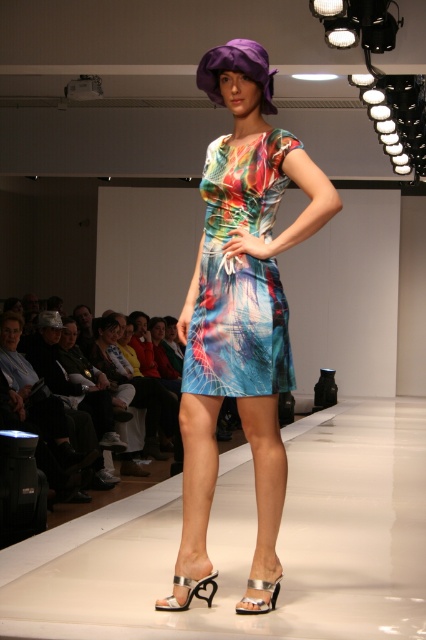
Between point (196, 285) and point (230, 202), which one is positioned behind?

Point (196, 285)

Is printed fabric dress at center shorter than multicolored printed fabric dress at center?

Incorrect, printed fabric dress at center's height does not fall short of multicolored printed fabric dress at center's.

Describe the element at coordinates (241, 314) in the screenshot. This screenshot has width=426, height=640. I see `printed fabric dress at center` at that location.

Where is `printed fabric dress at center`? This screenshot has width=426, height=640. printed fabric dress at center is located at coordinates (241, 314).

Which is more to the right, metallic silver sandals at center or printed fabric dress at center?

From the viewer's perspective, metallic silver sandals at center appears more on the right side.

Image resolution: width=426 pixels, height=640 pixels. Identify the location of metallic silver sandals at center. (250, 545).

Which is in front, point (389, 568) or point (282, 464)?

Point (282, 464) is in front.

Locate an element on the screen. The height and width of the screenshot is (640, 426). metallic silver sandals at center is located at coordinates (250, 545).

Which is below, metallic silver sandals at center or multicolored printed fabric dress at center?

metallic silver sandals at center is below.

Is point (368, 502) positioned before point (238, 260)?

No, (368, 502) is further to viewer.

What do you see at coordinates (250, 545) in the screenshot? I see `metallic silver sandals at center` at bounding box center [250, 545].

Where is `metallic silver sandals at center`? metallic silver sandals at center is located at coordinates (250, 545).